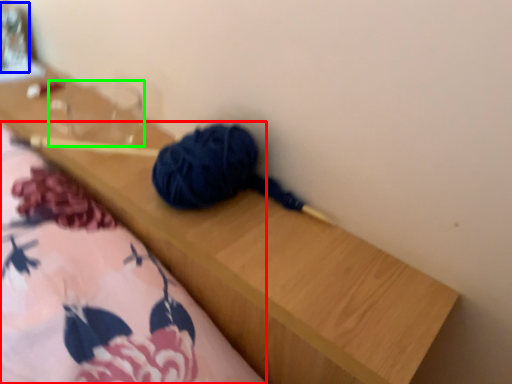
Question: Considering the real-world distances, which object is closest to blanket (highlighted by a red box)? glass jar (highlighted by a blue box) or clear (highlighted by a green box).

Choices:
 (A) glass jar
 (B) clear

Answer: (B)